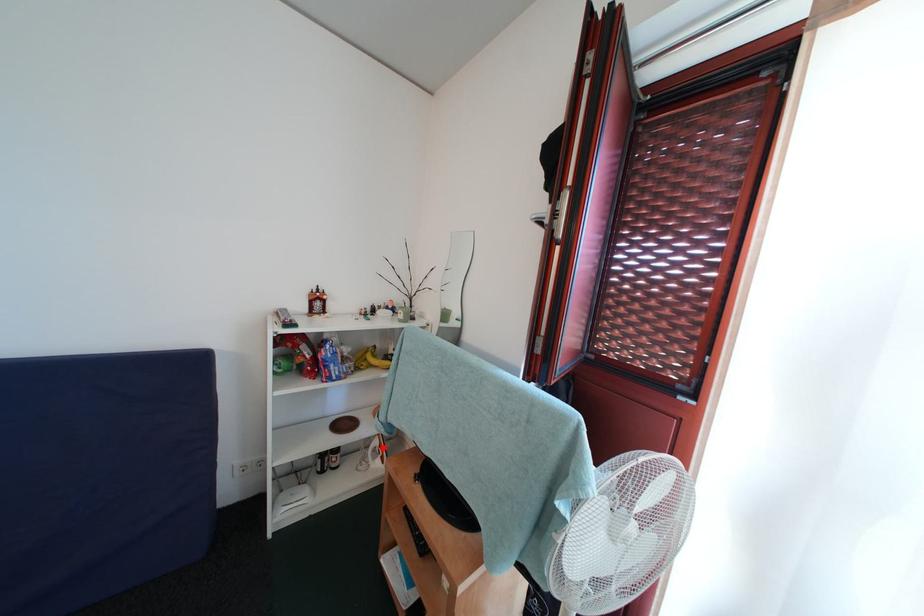
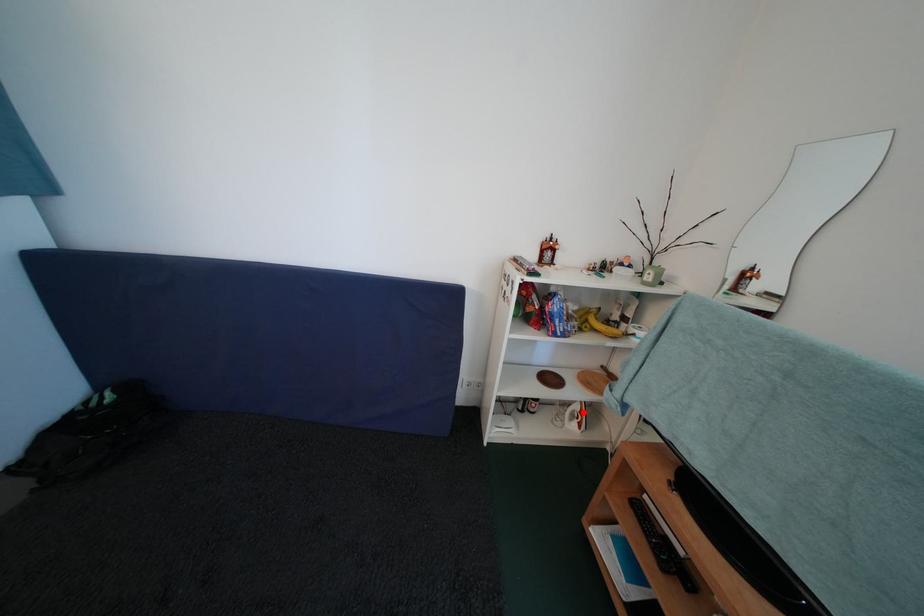
I am providing you with two images of the same scene from different viewpoints. A red point is marked on the first image and another point is marked on the second image. Does the point marked in image1 correspond to the same location as the one in image2?

Yes